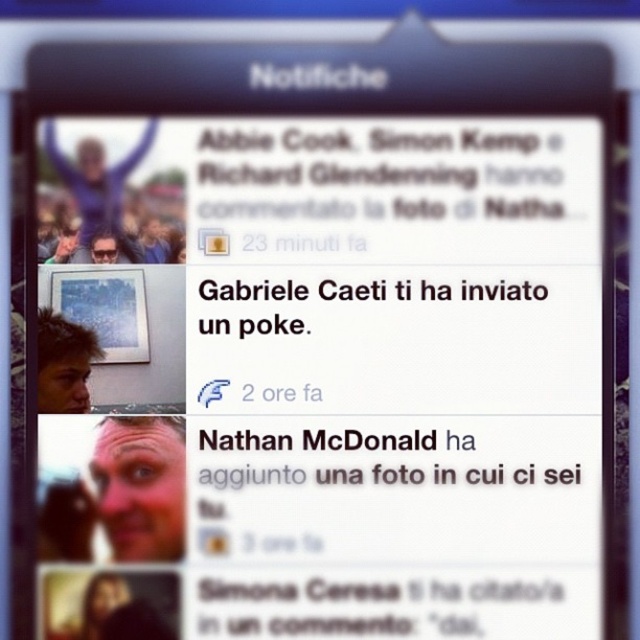
You are using a social media app and see the notification feed. You notice a point at coordinates (140, 484). What is located at that point?

The point at coordinates (140, 484) marks a blurred skin face at lower left.

You are looking at a social media notification feed on your phone. You see the blonde hair at left and the matte black sunglasses at upper left. Which object is positioned closer to your eyes?

The blonde hair at left is closer to the viewer than the matte black sunglasses at upper left.

Looking at the social media notifications on the mobile device, which object is positioned lower between the blonde hair at left and the matte black sunglasses at upper left?

The blonde hair at left is positioned below the matte black sunglasses at upper left, so the blonde hair at left is lower.